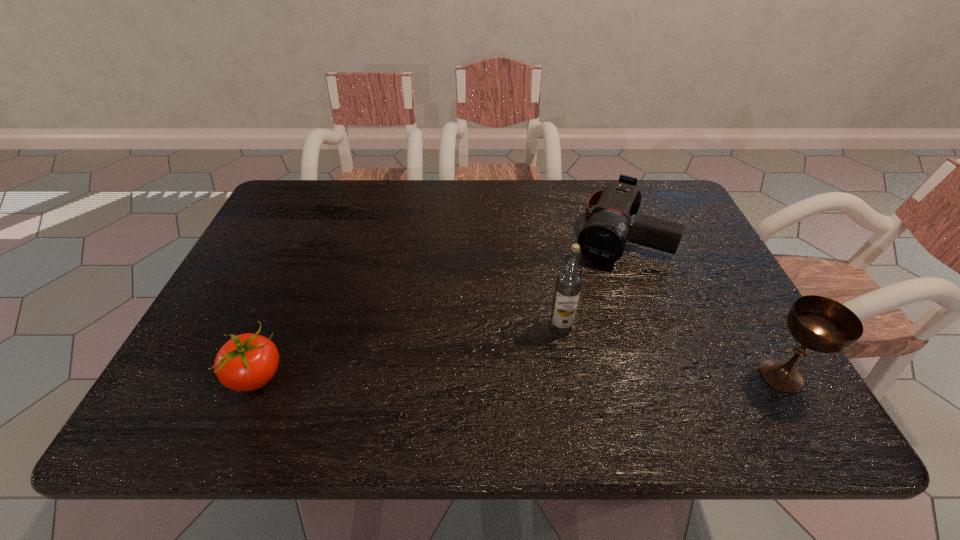
Locate an element on the screen. free space at the near right corner is located at coordinates (762, 357).

At what (x,y) coordinates should I click in order to perform the action: click on free space between the second object from right to left and the second tallest object. Please return your answer as a coordinate pair (x, y). The width and height of the screenshot is (960, 540). Looking at the image, I should click on (699, 305).

The image size is (960, 540). Find the location of `free space between the third shortest object and the tallest object`. free space between the third shortest object and the tallest object is located at coordinates (671, 352).

I want to click on vacant space in between the tallest object and the tomato, so click(409, 352).

At what (x,y) coordinates should I click in order to perform the action: click on free space that is in between the farthest object and the vodka. Please return your answer as a coordinate pair (x, y). Looking at the image, I should click on (588, 280).

Where is `free space between the camcorder and the tallest object`? free space between the camcorder and the tallest object is located at coordinates [x=588, y=280].

The width and height of the screenshot is (960, 540). Identify the location of vacant area that lies between the third shortest object and the second farthest object. (671, 352).

I want to click on free spot between the vodka and the tomato, so (x=409, y=352).

Image resolution: width=960 pixels, height=540 pixels. Find the location of `empty location between the third object from left to right and the third object from right to left`. empty location between the third object from left to right and the third object from right to left is located at coordinates (588, 280).

Where is `free space between the tomato and the second object from right to left`? The height and width of the screenshot is (540, 960). free space between the tomato and the second object from right to left is located at coordinates (437, 305).